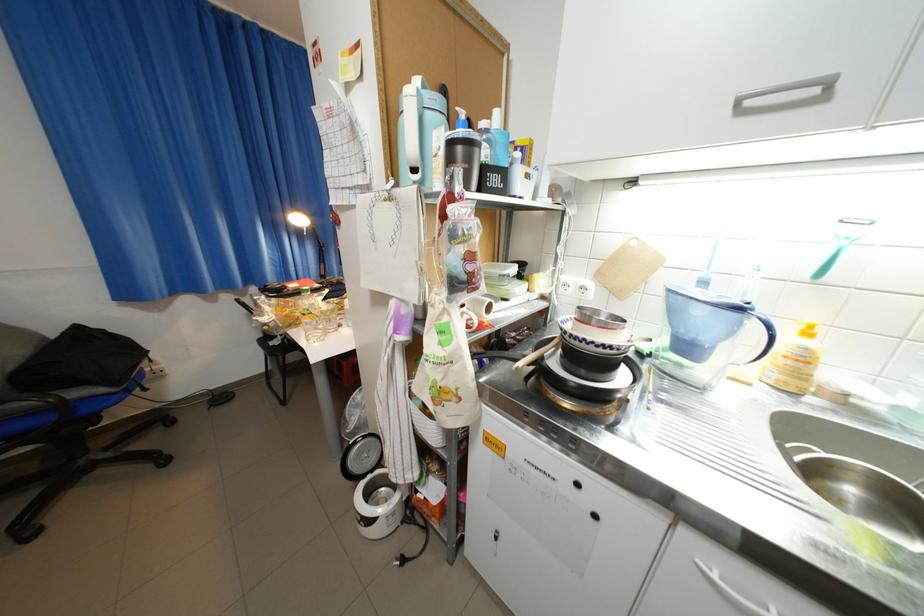
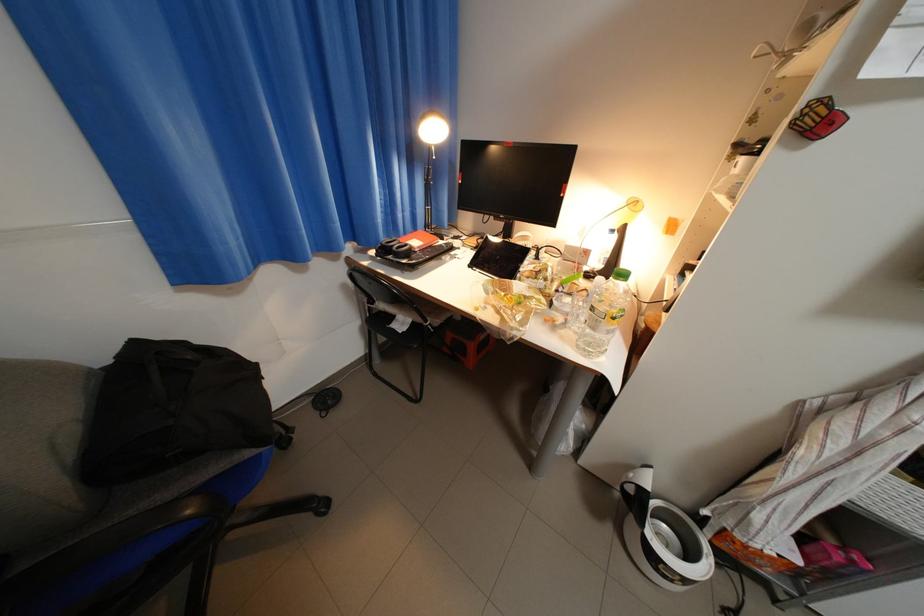
What movement of the cameraman would produce the second image?

The cameraman walked toward left, forward.